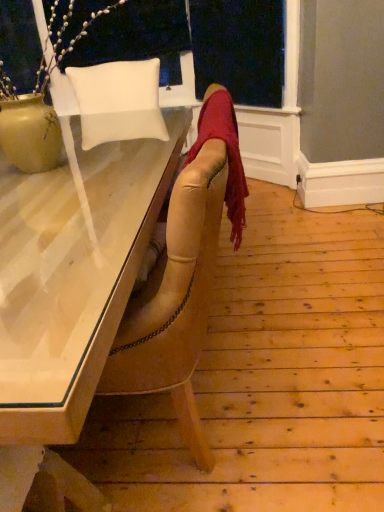
Question: Is matte ceramic vase at upper left beside matte white desk at center?

Choices:
 (A) yes
 (B) no

Answer: (B)

Question: From a real-world perspective, is matte ceramic vase at upper left physically above matte white desk at center?

Choices:
 (A) yes
 (B) no

Answer: (A)

Question: Is matte ceramic vase at upper left at the right side of matte white desk at center?

Choices:
 (A) yes
 (B) no

Answer: (A)

Question: Is matte ceramic vase at upper left wider than matte white desk at center?

Choices:
 (A) no
 (B) yes

Answer: (A)

Question: Is matte ceramic vase at upper left at the left side of matte white desk at center?

Choices:
 (A) no
 (B) yes

Answer: (A)

Question: Can we say matte ceramic vase at upper left lies outside matte white desk at center?

Choices:
 (A) yes
 (B) no

Answer: (A)

Question: Is velvet red scarf at center oriented towards white leather pillow at upper left?

Choices:
 (A) no
 (B) yes

Answer: (A)

Question: Considering the relative sizes of velvet red scarf at center and white leather pillow at upper left in the image provided, is velvet red scarf at center bigger than white leather pillow at upper left?

Choices:
 (A) no
 (B) yes

Answer: (A)

Question: Are velvet red scarf at center and white leather pillow at upper left beside each other?

Choices:
 (A) yes
 (B) no

Answer: (B)

Question: Is velvet red scarf at center shorter than white leather pillow at upper left?

Choices:
 (A) no
 (B) yes

Answer: (B)

Question: From the image's perspective, is velvet red scarf at center located beneath white leather pillow at upper left?

Choices:
 (A) yes
 (B) no

Answer: (A)

Question: Does velvet red scarf at center come in front of white leather pillow at upper left?

Choices:
 (A) yes
 (B) no

Answer: (A)

Question: Does white leather pillow at upper left turn towards velvet red scarf at center?

Choices:
 (A) yes
 (B) no

Answer: (B)